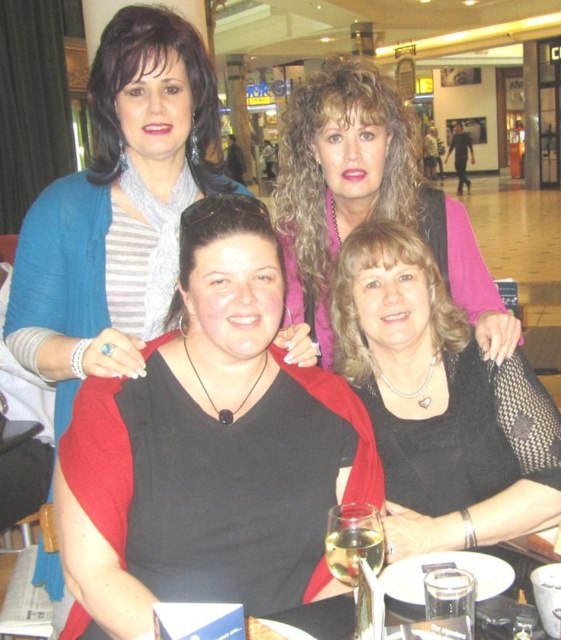
You are a photographer trying to focus on the black matte shirt at center. Based on the coordinates provided, where should you aim your camera lens?

The black matte shirt at center is located at coordinates point (x=218, y=435), so you should aim your camera lens at that point to focus on it.

You are a photographer trying to adjust the lighting for a group photo. You notice the black matte shirt at center and the matte pink sweater at upper center. Which object is positioned to the left of the other?

The black matte shirt at center is to the left of the matte pink sweater at upper center.

You are a photographer trying to capture the best shot of the group. You notice the black matte shirt at center and the black matte dress at center are overlapping. Which one is covering part of the other?

The black matte shirt at center is positioned under the black matte dress at center, so the dress is covering part of the shirt.